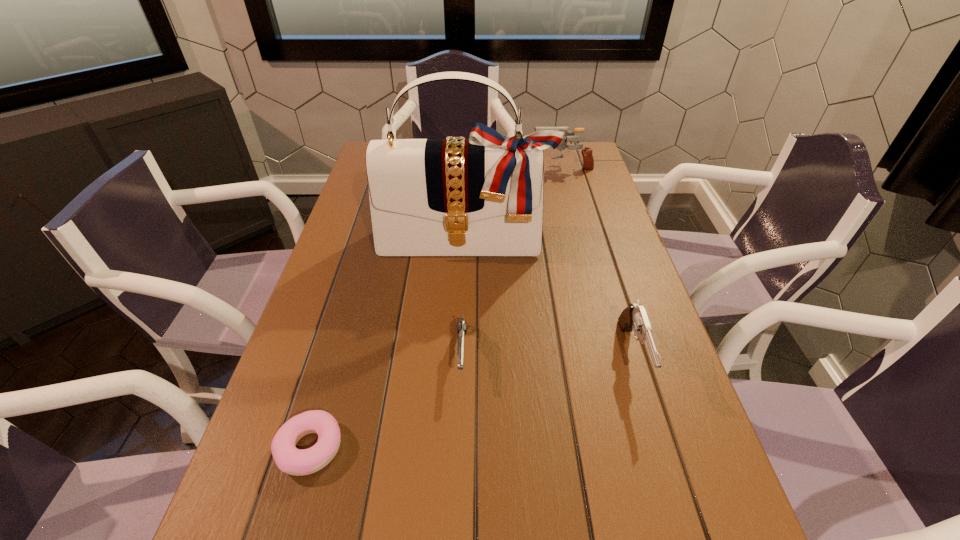
At what (x,y) coordinates should I click in order to perform the action: click on vacant position at the left edge of the desktop. Please return your answer as a coordinate pair (x, y). Looking at the image, I should click on (363, 262).

Identify the location of blank area at the right edge. (570, 184).

Where is `empty space that is in between the fourth nearest object and the second shortest gun`? This screenshot has height=540, width=960. empty space that is in between the fourth nearest object and the second shortest gun is located at coordinates (549, 299).

Locate an element on the screen. Image resolution: width=960 pixels, height=540 pixels. free spot between the pastry and the leftmost gun is located at coordinates (386, 401).

Where is `vacant area that lies between the second shortest object and the second tallest gun`? This screenshot has width=960, height=540. vacant area that lies between the second shortest object and the second tallest gun is located at coordinates (548, 355).

Find the location of a particular element. The height and width of the screenshot is (540, 960). vacant space that's between the shortest object and the fourth nearest object is located at coordinates (387, 345).

This screenshot has height=540, width=960. Identify the location of blank region between the leftmost gun and the pastry. (386, 401).

Image resolution: width=960 pixels, height=540 pixels. I want to click on vacant region between the nearest object and the third shortest object, so click(x=471, y=402).

Identify the location of free area in between the second tallest gun and the satchel. (549, 299).

The width and height of the screenshot is (960, 540). I want to click on unoccupied area between the tallest object and the pastry, so click(387, 345).